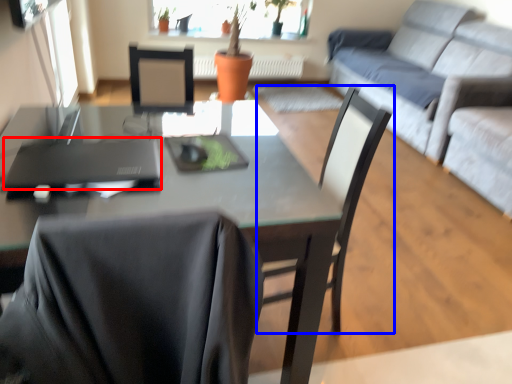
Question: Among these objects, which one is nearest to the camera, laptop (highlighted by a red box) or chair (highlighted by a blue box)?

Choices:
 (A) laptop
 (B) chair

Answer: (A)